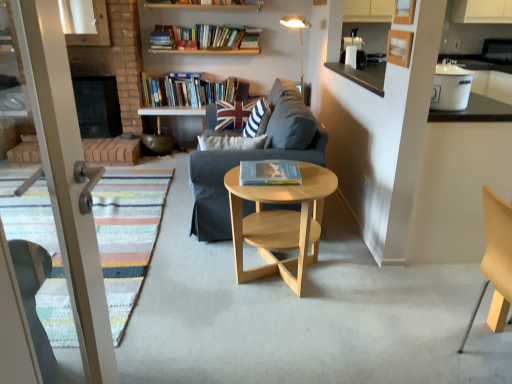
I want to click on vacant area on top of natural wood coffee table at center (from a real-world perspective), so click(292, 181).